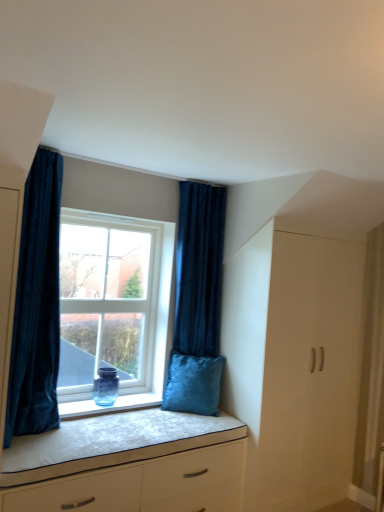
Question: Can you confirm if velvet dark blue curtain at right, the first curtain in the back-to-front sequence, is thinner than white matte chest of drawers at lower center?

Choices:
 (A) no
 (B) yes

Answer: (B)

Question: Is velvet dark blue curtain at right, the first curtain in the back-to-front sequence, taller than white matte chest of drawers at lower center?

Choices:
 (A) no
 (B) yes

Answer: (B)

Question: Does velvet dark blue curtain at right, which is the 2th curtain from left to right, have a larger size compared to white matte chest of drawers at lower center?

Choices:
 (A) no
 (B) yes

Answer: (A)

Question: Considering the relative positions of velvet dark blue curtain at right, the 1th curtain viewed from the right, and white matte chest of drawers at lower center in the image provided, is velvet dark blue curtain at right, the 1th curtain viewed from the right, in front of white matte chest of drawers at lower center?

Choices:
 (A) yes
 (B) no

Answer: (B)

Question: From the image's perspective, would you say velvet dark blue curtain at right, which is the 2th curtain from left to right, is positioned over white matte chest of drawers at lower center?

Choices:
 (A) no
 (B) yes

Answer: (B)

Question: From a real-world perspective, relative to white matte chest of drawers at lower center, is transparent glass window at center vertically above or below?

Choices:
 (A) below
 (B) above

Answer: (B)

Question: Considering their positions, is transparent glass window at center located in front of or behind white matte chest of drawers at lower center?

Choices:
 (A) front
 (B) behind

Answer: (B)

Question: Based on their sizes in the image, would you say transparent glass window at center is bigger or smaller than white matte chest of drawers at lower center?

Choices:
 (A) small
 (B) big

Answer: (A)

Question: Would you say transparent glass window at center is to the left or to the right of white matte chest of drawers at lower center in the picture?

Choices:
 (A) left
 (B) right

Answer: (A)

Question: Considering the positions of white matte wardrobe at right and transparent glass window at center in the image, is white matte wardrobe at right taller or shorter than transparent glass window at center?

Choices:
 (A) tall
 (B) short

Answer: (A)

Question: Based on their sizes in the image, would you say white matte wardrobe at right is bigger or smaller than transparent glass window at center?

Choices:
 (A) big
 (B) small

Answer: (A)

Question: From a real-world perspective, is white matte wardrobe at right physically located above or below transparent glass window at center?

Choices:
 (A) below
 (B) above

Answer: (A)

Question: Choose the correct answer: Is white matte wardrobe at right inside transparent glass window at center or outside it?

Choices:
 (A) inside
 (B) outside

Answer: (B)

Question: In terms of size, does white matte chest of drawers at lower center appear bigger or smaller than velvet dark blue curtain at left, which ranks as the 1th curtain in front-to-back order?

Choices:
 (A) big
 (B) small

Answer: (A)

Question: Considering the positions of point (243, 429) and point (31, 249), is point (243, 429) closer or farther from the camera than point (31, 249)?

Choices:
 (A) closer
 (B) farther

Answer: (B)